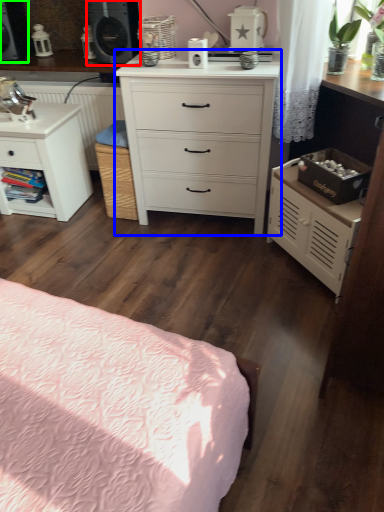
Question: Which object is positioned closest to speaker (highlighted by a red box)? Select from chest of drawers (highlighted by a blue box) and speaker (highlighted by a green box).

Choices:
 (A) chest of drawers
 (B) speaker

Answer: (B)